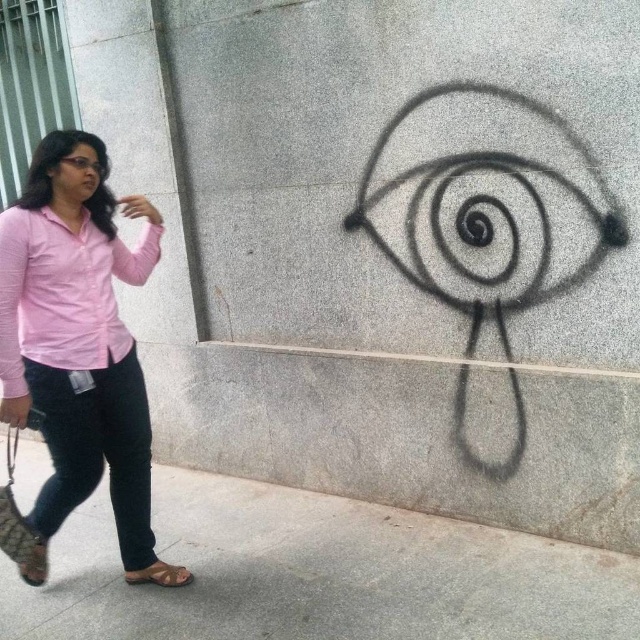
Does pink matte shirt at left have a larger size compared to brown leather sandal at lower left?

Yes.

The height and width of the screenshot is (640, 640). Identify the location of pink matte shirt at left. (64, 292).

Locate an element on the screen. pink matte shirt at left is located at coordinates (64, 292).

Between point (35, 547) and point (157, 584), which one is positioned in front?

Point (35, 547) is more forward.

Is the position of leather textured sandal at lower left less distant than that of brown leather sandal at lower left?

Yes, leather textured sandal at lower left is closer to the viewer.

Image resolution: width=640 pixels, height=640 pixels. I want to click on leather textured sandal at lower left, so click(x=20, y=540).

In the scene shown: Is gray concrete pavement at lower right closer to the viewer compared to leather textured sandal at lower left?

Yes, gray concrete pavement at lower right is closer to the viewer.

Which is above, gray concrete pavement at lower right or leather textured sandal at lower left?

Positioned higher is leather textured sandal at lower left.

The height and width of the screenshot is (640, 640). I want to click on gray concrete pavement at lower right, so click(x=317, y=573).